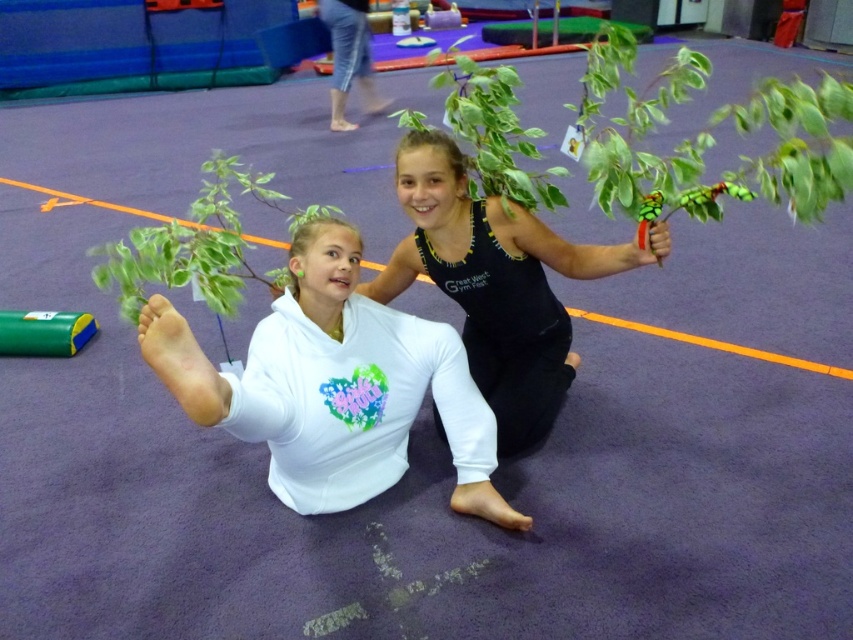
Measure the distance between black matte tank top at center and green leafy plant at center.

black matte tank top at center and green leafy plant at center are 23.22 inches apart.

Is black matte tank top at center bigger than green leafy plant at center?

Yes, black matte tank top at center is bigger than green leafy plant at center.

Is point (408, 164) farther from camera compared to point (300, 225)?

That is False.

Find the location of a particular element. This screenshot has width=853, height=640. black matte tank top at center is located at coordinates (495, 284).

Is green leafy plant at center wider than green glossy plant at center?

Indeed, green leafy plant at center has a greater width compared to green glossy plant at center.

Who is shorter, green leafy plant at center or green glossy plant at center?

green glossy plant at center is shorter.

Measure the distance between green leafy plant at center and camera.

green leafy plant at center is 5.73 feet from camera.

The width and height of the screenshot is (853, 640). I want to click on green leafy plant at center, so click(199, 244).

Does white matte hoodie at center lie behind black matte tank top at center?

No, white matte hoodie at center is closer to the viewer.

Is white matte hoodie at center taller than black matte tank top at center?

No, white matte hoodie at center is not taller than black matte tank top at center.

Image resolution: width=853 pixels, height=640 pixels. What do you see at coordinates (334, 387) in the screenshot? I see `white matte hoodie at center` at bounding box center [334, 387].

This screenshot has width=853, height=640. Identify the location of white matte hoodie at center. (334, 387).